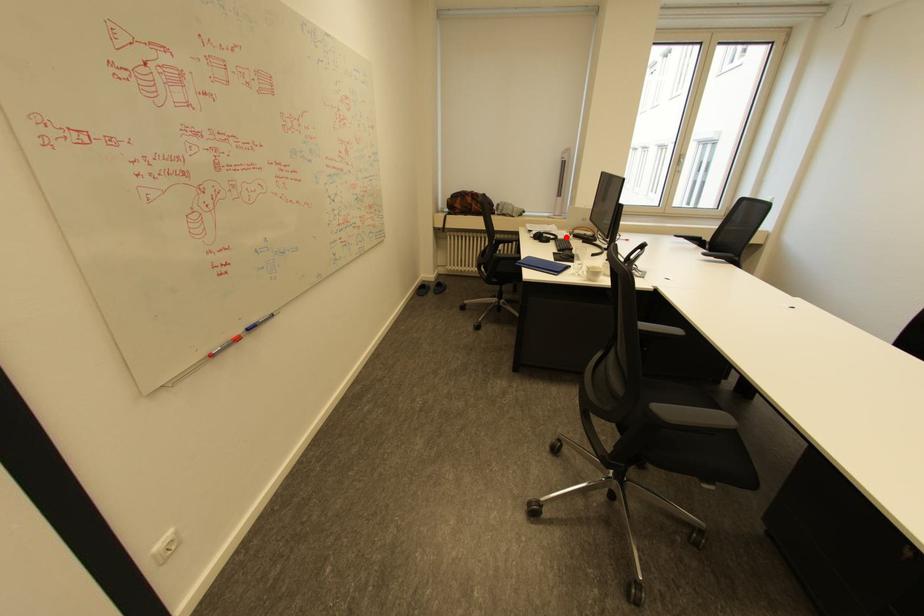
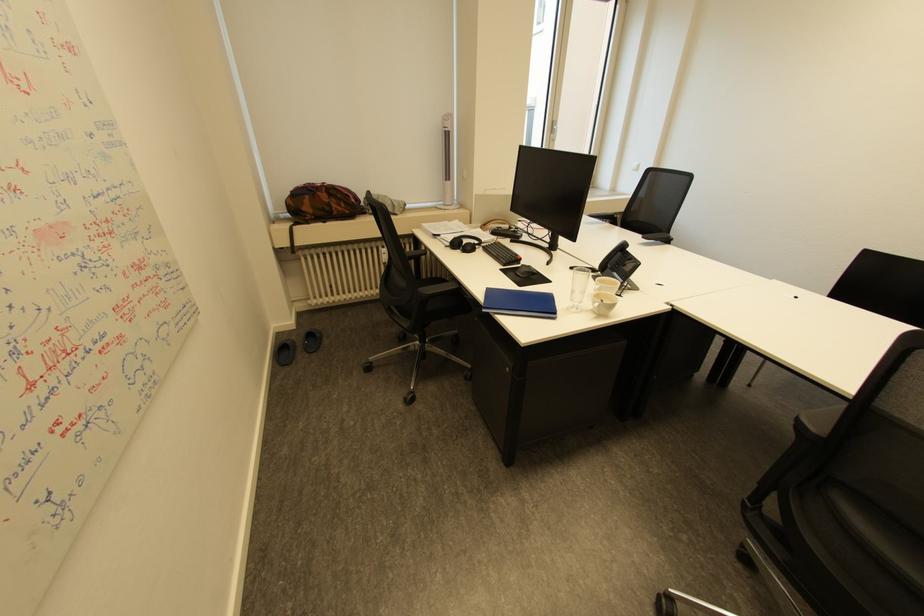
In the second image, find the point that corresponds to the highlighted location in the first image.

(490, 240)